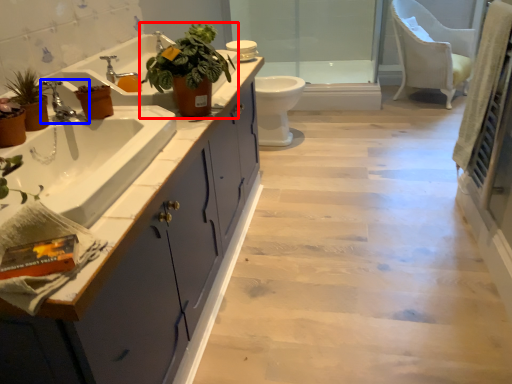
Question: Which point is further to the camera, houseplant (highlighted by a red box) or tap (highlighted by a blue box)?

Choices:
 (A) houseplant
 (B) tap

Answer: (A)